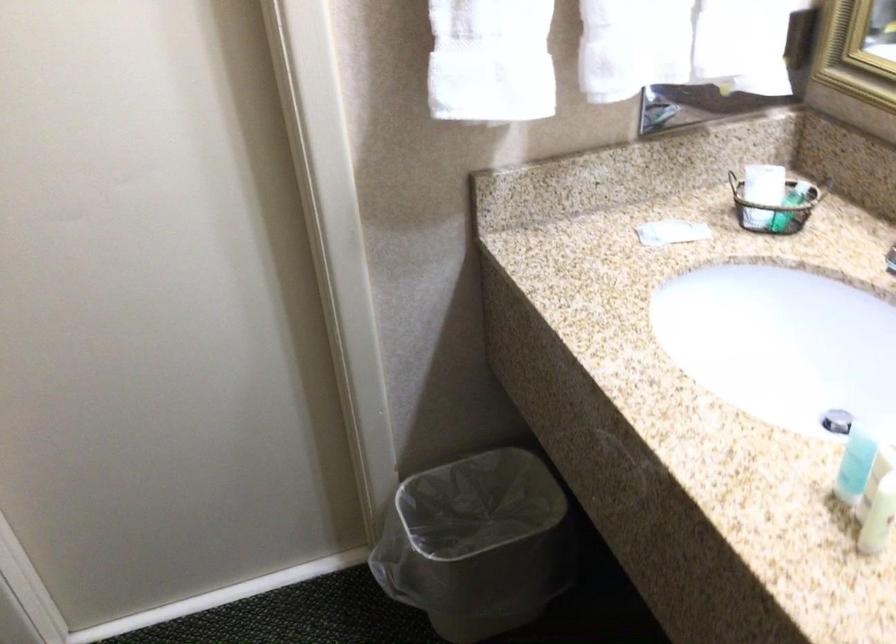
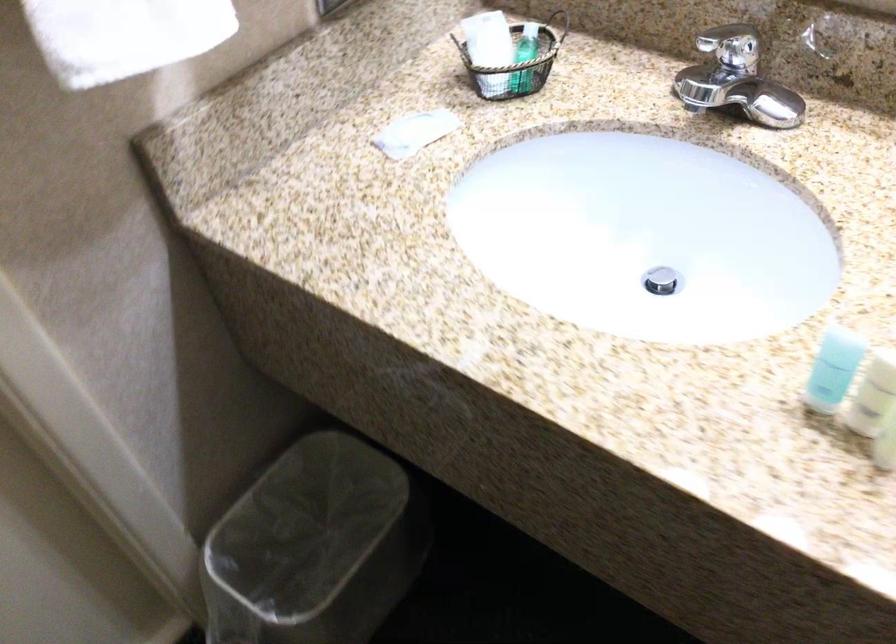
In the second image, find the point that corresponds to pixel 668 232 in the first image.

(414, 131)